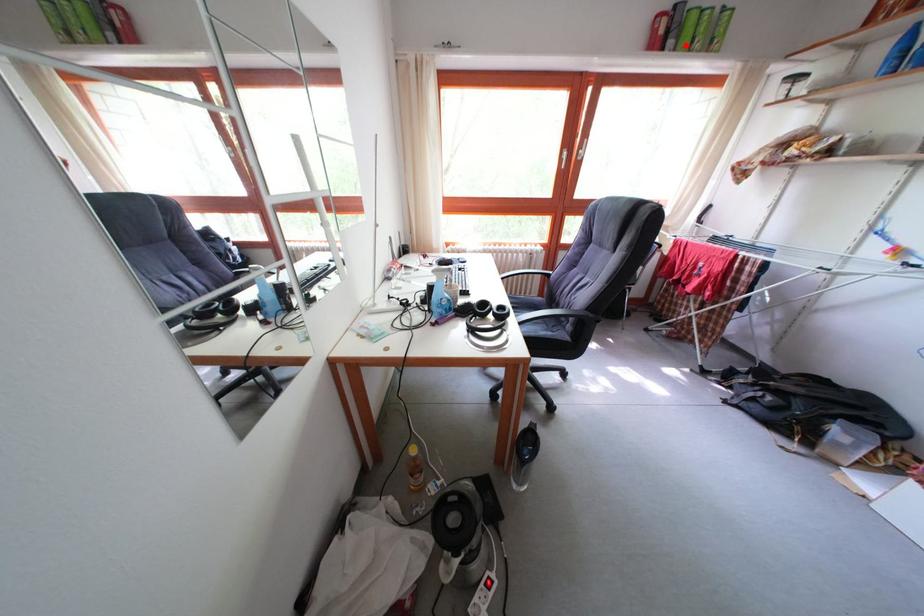
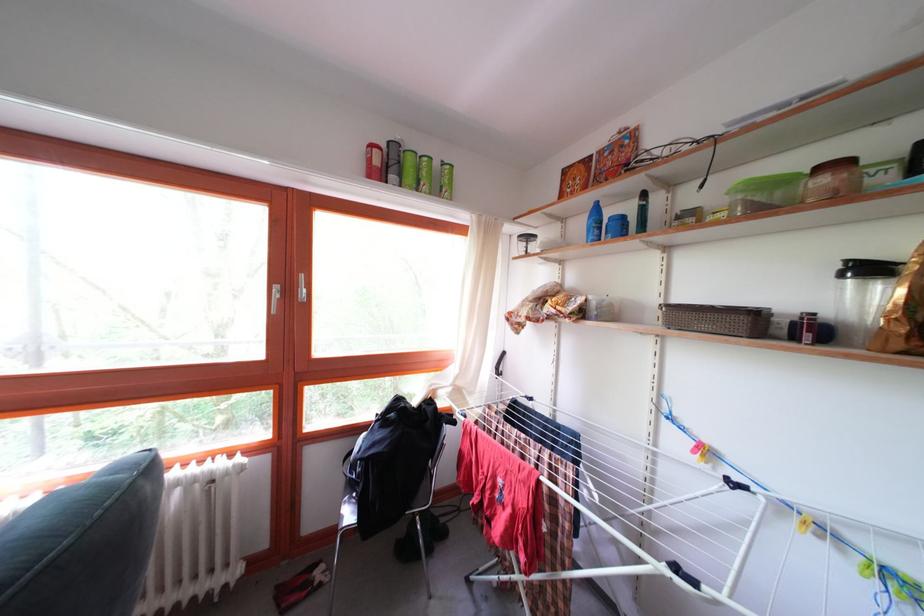
Where in the second image is the point corresponding to the highlighted location from the first image?

(409, 180)